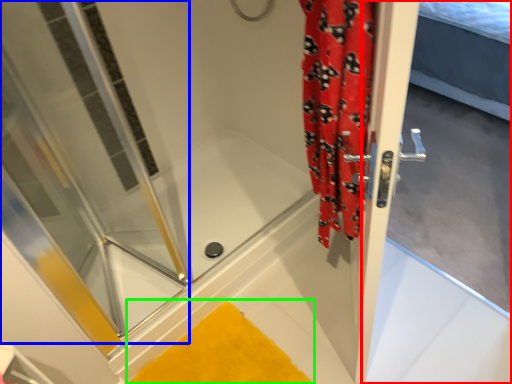
Question: Based on their relative distances, which object is farther from screen door (highlighted by a red box)? Choose from shower door (highlighted by a blue box) and bath mat (highlighted by a green box).

Choices:
 (A) shower door
 (B) bath mat

Answer: (A)